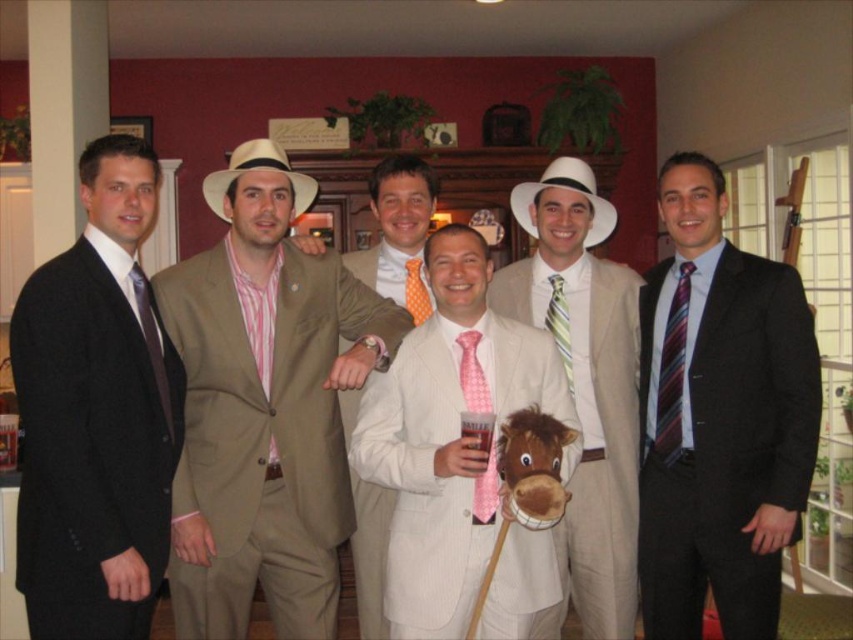
Can you confirm if white felt cowboy hat at center is taller than striped silk tie at center?

No.

Does white felt cowboy hat at center come behind striped silk tie at center?

That is True.

Is point (515, 205) closer to camera compared to point (550, 292)?

No.

The width and height of the screenshot is (853, 640). I want to click on white felt cowboy hat at center, so click(569, 189).

How distant is striped tie at right from white straw hat at center?

They are 1.40 meters apart.

Does point (706, 397) come closer to viewer compared to point (259, 148)?

No, (706, 397) is behind (259, 148).

Locate an element on the screen. striped tie at right is located at coordinates (720, 417).

Is matte black suit at left to the left of light beige suit at center from the viewer's perspective?

Correct, you'll find matte black suit at left to the left of light beige suit at center.

Who is more forward, (44, 500) or (577, 509)?

Point (44, 500)

Identify the location of matte black suit at left. (96, 413).